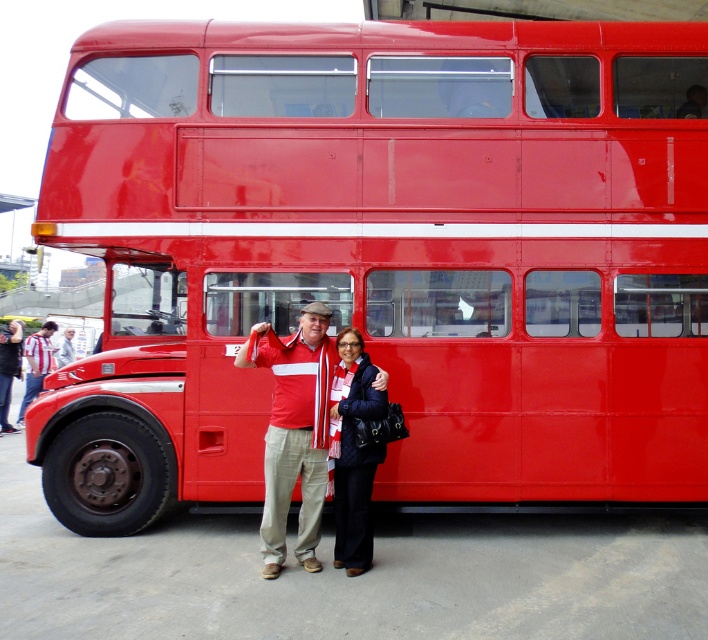
Question: Can you confirm if matte red shirt at center is positioned below striped fabric shirt at left?

Choices:
 (A) yes
 (B) no

Answer: (A)

Question: Which object is farther from the camera taking this photo?

Choices:
 (A) quilted black jacket at lower center
 (B) matte red shirt at center
 (C) striped fabric shirt at left

Answer: (C)

Question: Among these objects, which one is nearest to the camera?

Choices:
 (A) quilted black jacket at lower center
 (B) matte red shirt at center
 (C) striped fabric shirt at left

Answer: (B)

Question: Observing the image, what is the correct spatial positioning of matte red shirt at center in reference to striped fabric shirt at left?

Choices:
 (A) below
 (B) above

Answer: (A)

Question: Which point is closer to the camera?

Choices:
 (A) quilted black jacket at lower center
 (B) matte red shirt at center
 (C) striped fabric shirt at left

Answer: (B)

Question: Is matte red shirt at center bigger than striped fabric shirt at left?

Choices:
 (A) no
 (B) yes

Answer: (A)